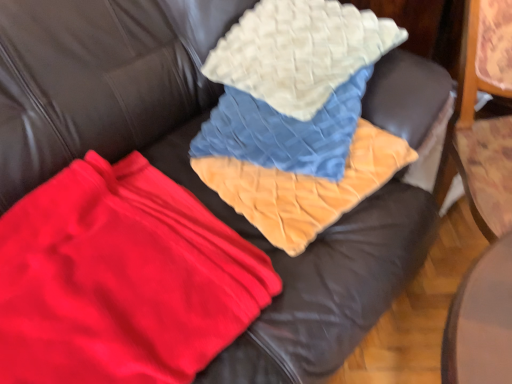
Find the location of a particular element. velvet orange blanket at center is located at coordinates (305, 188).

The image size is (512, 384). In order to click on red fleece blanket at center in this screenshot , I will do `click(121, 279)`.

Is red fleece blanket at center smaller than velvet orange blanket at center?

No.

Considering the sizes of objects red fleece blanket at center and velvet orange blanket at center in the image provided, who is shorter, red fleece blanket at center or velvet orange blanket at center?

Standing shorter between the two is red fleece blanket at center.

From the image's perspective, is red fleece blanket at center on top of velvet orange blanket at center?

Actually, red fleece blanket at center appears below velvet orange blanket at center in the image.

Considering the positions of objects red fleece blanket at center and velvet orange blanket at center in the image provided, who is more to the right, red fleece blanket at center or velvet orange blanket at center?

Positioned to the right is velvet orange blanket at center.

From the image's perspective, which is above, white quilted pillow at upper center or red fleece blanket at center?

white quilted pillow at upper center.

Considering the sizes of objects white quilted pillow at upper center and red fleece blanket at center in the image provided, who is wider, white quilted pillow at upper center or red fleece blanket at center?

red fleece blanket at center is wider.

This screenshot has width=512, height=384. What are the coordinates of `fabric that appears on the left of white quilted pillow at upper center` in the screenshot? It's located at (121, 279).

Between point (287, 6) and point (52, 187), which one is positioned in front?

The point (52, 187) is in front.

Is white quilted pillow at upper center wider or thinner than velvet orange blanket at center?

Clearly, white quilted pillow at upper center has less width compared to velvet orange blanket at center.

From their relative heights in the image, would you say white quilted pillow at upper center is taller or shorter than velvet orange blanket at center?

In the image, white quilted pillow at upper center appears to be taller than velvet orange blanket at center.

Is white quilted pillow at upper center not within velvet orange blanket at center?

Yes, white quilted pillow at upper center is not within velvet orange blanket at center.

From a real-world perspective, which object rests below the other?

velvet orange blanket at center, from a real-world perspective.

Which object is more forward, red fleece blanket at center or white quilted pillow at upper center?

red fleece blanket at center is closer to the camera.

Is red fleece blanket at center not close to white quilted pillow at upper center?

No, red fleece blanket at center is in close proximity to white quilted pillow at upper center.

From a real-world perspective, is red fleece blanket at center physically above white quilted pillow at upper center?

Actually, red fleece blanket at center is physically below white quilted pillow at upper center in the real world.

Does velvet orange blanket at center contain white quilted pillow at upper center?

No, white quilted pillow at upper center is not a part of velvet orange blanket at center.

Is velvet orange blanket at center bigger or smaller than white quilted pillow at upper center?

Clearly, velvet orange blanket at center is smaller in size than white quilted pillow at upper center.

Can you tell me how much velvet orange blanket at center and white quilted pillow at upper center differ in facing direction?

The angular difference between velvet orange blanket at center and white quilted pillow at upper center is 0.0617 degrees.

Does point (234, 182) lie behind point (243, 239)?

Yes, it is.

Based on their positions, is velvet orange blanket at center located to the left or right of red fleece blanket at center?

In the image, velvet orange blanket at center appears on the right side of red fleece blanket at center.

Between velvet orange blanket at center and red fleece blanket at center, which one has smaller width?

With smaller width is velvet orange blanket at center.

Where is `fabric directly beneath the velvet orange blanket at center (from a real-world perspective)`? This screenshot has width=512, height=384. fabric directly beneath the velvet orange blanket at center (from a real-world perspective) is located at coordinates (121, 279).

What are the coordinates of `fabric below the white quilted pillow at upper center (from the image's perspective)` in the screenshot? It's located at (121, 279).

Estimate the real-world distances between objects in this image. Which object is further from white quilted pillow at upper center, velvet orange blanket at center or red fleece blanket at center?

red fleece blanket at center.

From the image, which object appears to be farther from white quilted pillow at upper center, red fleece blanket at center or velvet orange blanket at center?

red fleece blanket at center is positioned further to the anchor white quilted pillow at upper center.

Considering their positions, is red fleece blanket at center positioned closer to velvet orange blanket at center than white quilted pillow at upper center?

white quilted pillow at upper center.

Based on their spatial positions, is white quilted pillow at upper center or velvet orange blanket at center further from red fleece blanket at center?

white quilted pillow at upper center lies further to red fleece blanket at center than the other object.

Looking at the image, which one is located further to velvet orange blanket at center, white quilted pillow at upper center or red fleece blanket at center?

Based on the image, red fleece blanket at center appears to be further to velvet orange blanket at center.

Considering their positions, is velvet orange blanket at center positioned closer to red fleece blanket at center than white quilted pillow at upper center?

velvet orange blanket at center lies closer to red fleece blanket at center than the other object.

At what (x,y) coordinates should I click in order to perform the action: click on blanket between white quilted pillow at upper center and red fleece blanket at center in the up-down direction. Please return your answer as a coordinate pair (x, y). The image size is (512, 384). Looking at the image, I should click on (305, 188).